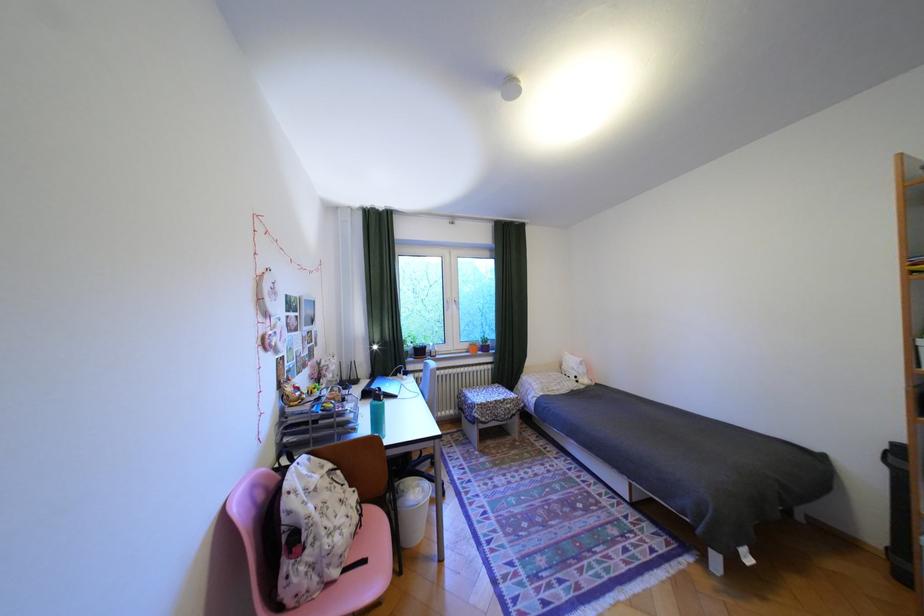
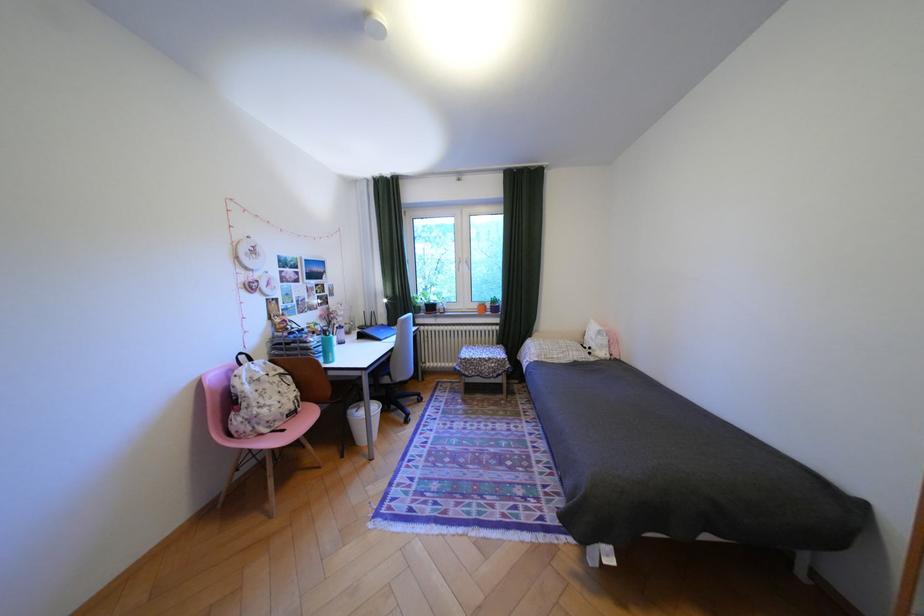
Question: What movement of the cameraman would produce the second image?

Choices:
 (A) Left
 (B) Right
 (C) Forward
 (D) Backward

Answer: (B)